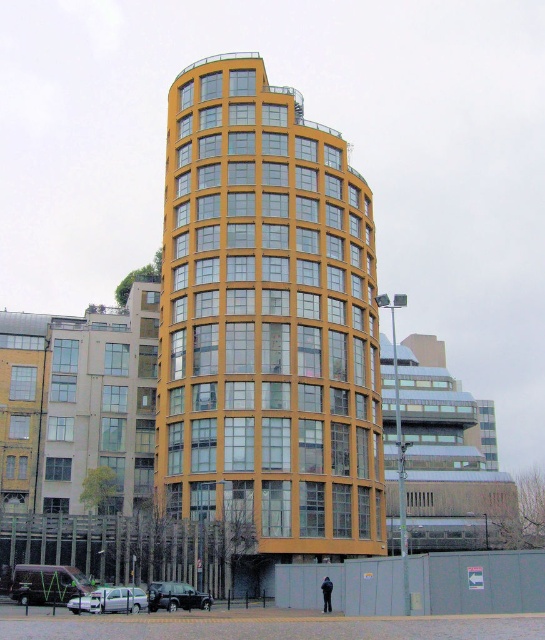
Question: Is yellow glass building at center below dark blue fabric at lower center?

Choices:
 (A) no
 (B) yes

Answer: (A)

Question: Which object appears farthest from the camera in this image?

Choices:
 (A) dark blue fabric at lower center
 (B) yellow glass building at center

Answer: (B)

Question: Is yellow glass building at center thinner than dark blue fabric at lower center?

Choices:
 (A) yes
 (B) no

Answer: (B)

Question: Among these points, which one is farthest from the camera?

Choices:
 (A) (325, 577)
 (B) (225, 486)

Answer: (B)

Question: Observing the image, what is the correct spatial positioning of yellow glass building at center in reference to dark blue fabric at lower center?

Choices:
 (A) right
 (B) left

Answer: (B)

Question: Which object appears closest to the camera in this image?

Choices:
 (A) yellow glass building at center
 (B) dark blue fabric at lower center

Answer: (B)